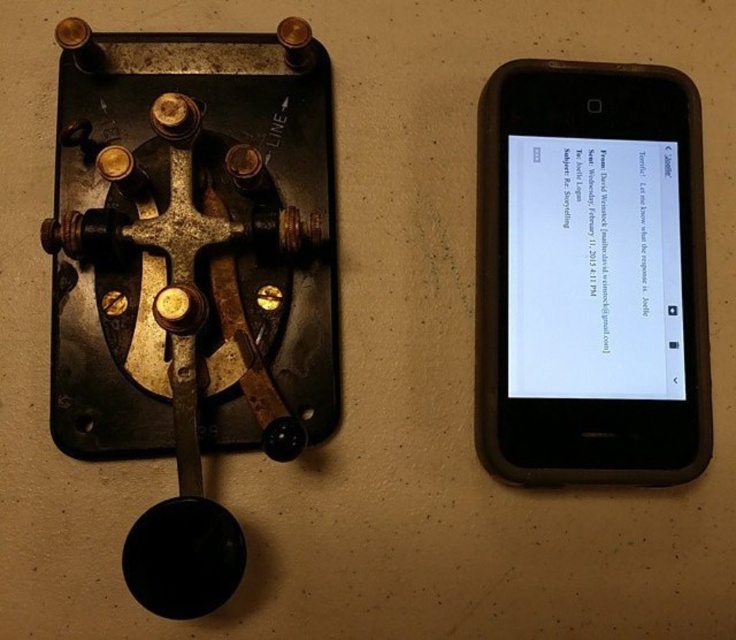
Question: Does rusty metal/brass hook at center-left appear under black plastic smartphone at right?

Choices:
 (A) no
 (B) yes

Answer: (B)

Question: Is rusty metal/brass hook at center-left thinner than black plastic smartphone at right?

Choices:
 (A) yes
 (B) no

Answer: (B)

Question: Is rusty metal/brass hook at center-left closer to the viewer compared to black plastic smartphone at right?

Choices:
 (A) yes
 (B) no

Answer: (A)

Question: Which point is farther from the camera taking this photo?

Choices:
 (A) (523, 77)
 (B) (127, 250)

Answer: (A)

Question: Which of the following is the farthest from the observer?

Choices:
 (A) black plastic smartphone at right
 (B) rusty metal/brass hook at center-left

Answer: (A)